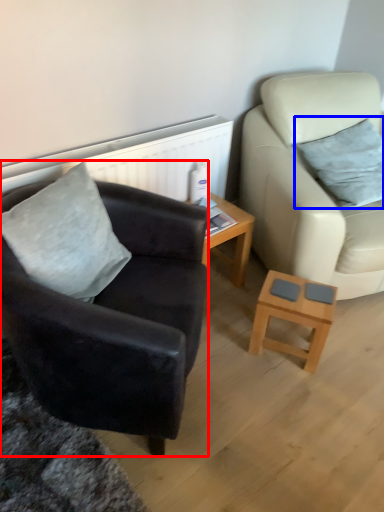
Question: Which object is further to the camera taking this photo, chair (highlighted by a red box) or pillow (highlighted by a blue box)?

Choices:
 (A) chair
 (B) pillow

Answer: (B)